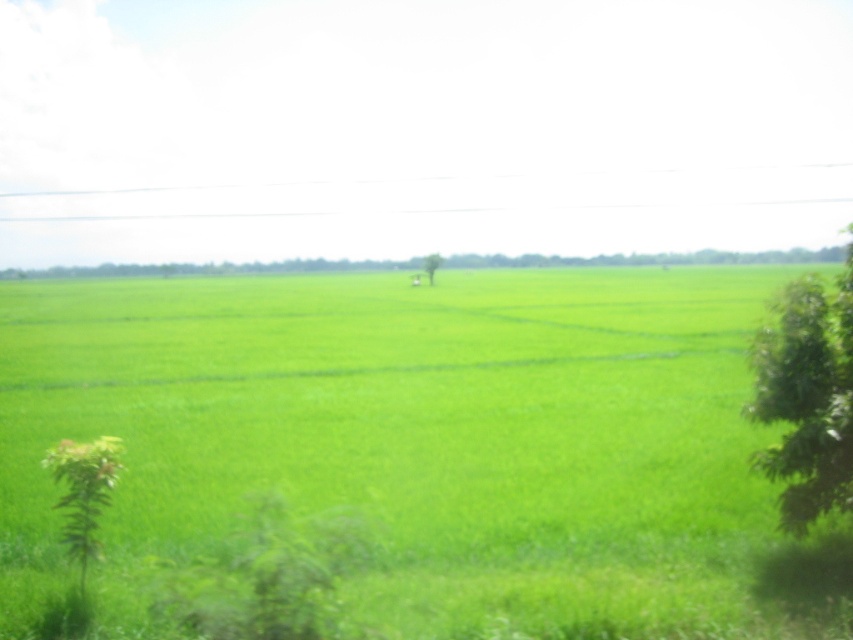
Question: Does green leafy tree at right have a lesser width compared to green leafy tree at center?

Choices:
 (A) no
 (B) yes

Answer: (A)

Question: Can you confirm if green grass at center is positioned above green leafy tree at right?

Choices:
 (A) yes
 (B) no

Answer: (A)

Question: Can you confirm if green grass at center is smaller than green leafy tree at right?

Choices:
 (A) no
 (B) yes

Answer: (A)

Question: Which point appears closest to the camera in this image?

Choices:
 (A) (579, 428)
 (B) (426, 269)
 (C) (822, 294)

Answer: (C)

Question: Estimate the real-world distances between objects in this image. Which object is farther from the green leafy tree at right?

Choices:
 (A) green grass at center
 (B) green leafy tree at center

Answer: (B)

Question: Based on their relative distances, which object is nearer to the green leafy tree at right?

Choices:
 (A) green grass at center
 (B) green leafy tree at center

Answer: (A)